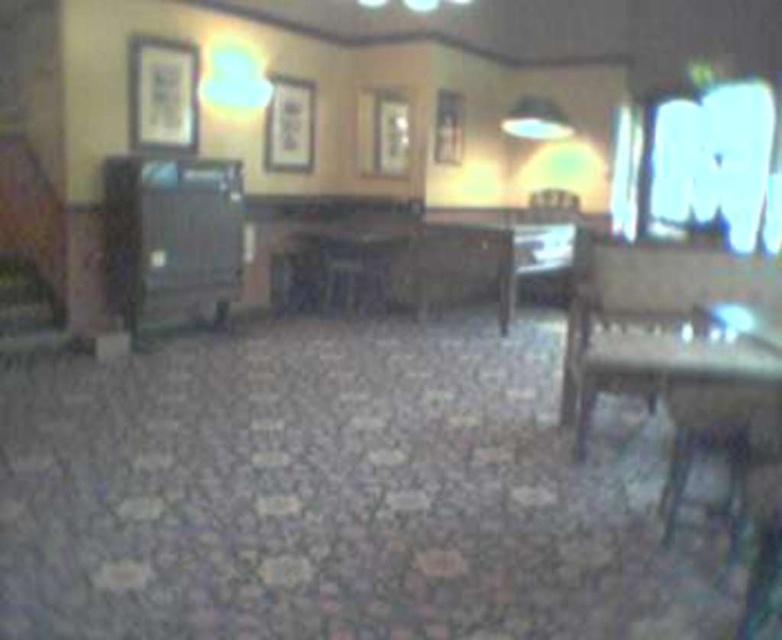
You are a customer in this dining establishment and want to place your phone on the wooden table at lower right and the matte white lampshade at upper center. Which surface can accommodate a larger phone?

The wooden table at lower right is bigger than the matte white lampshade at upper center, so it can accommodate a larger phone.

You are standing at the entrance of the dining establishment and want to sit at the wooden table at lower right. Based on the coordinates provided, in which direction should you walk to reach it?

The wooden table at lower right is located at coordinates point (691, 388). Since coordinates typically increase from the top left corner, the lower right position means you should walk towards the bottom right direction to reach it.